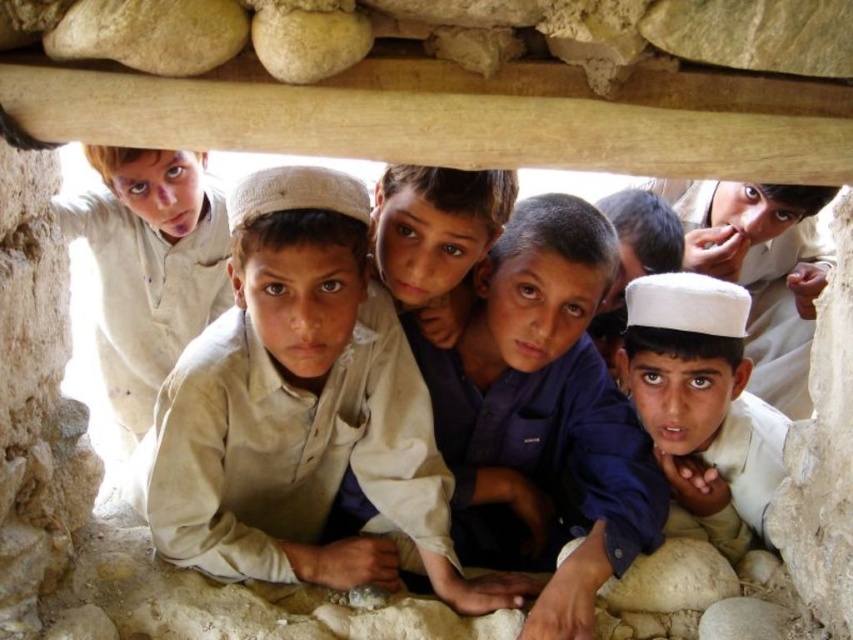
Question: Which object is closer to the camera taking this photo?

Choices:
 (A) blue cotton shirt at center
 (B) white matte cap at center
 (C) light beige cotton shirt at center

Answer: (C)

Question: Which is nearer to the blue cotton shirt at center?

Choices:
 (A) light beige cotton shirt at center
 (B) white matte cap at center

Answer: (B)

Question: Among these points, which one is nearest to the camera?

Choices:
 (A) (718, 378)
 (B) (590, 225)

Answer: (B)

Question: Is light beige cotton shirt at center positioned in front of blue cotton shirt at center?

Choices:
 (A) no
 (B) yes

Answer: (B)

Question: From the image, what is the correct spatial relationship of light beige cotton shirt at center in relation to white matte cap at center?

Choices:
 (A) below
 (B) above

Answer: (B)

Question: Can you confirm if light beige cotton shirt at center is wider than blue cotton shirt at center?

Choices:
 (A) no
 (B) yes

Answer: (B)